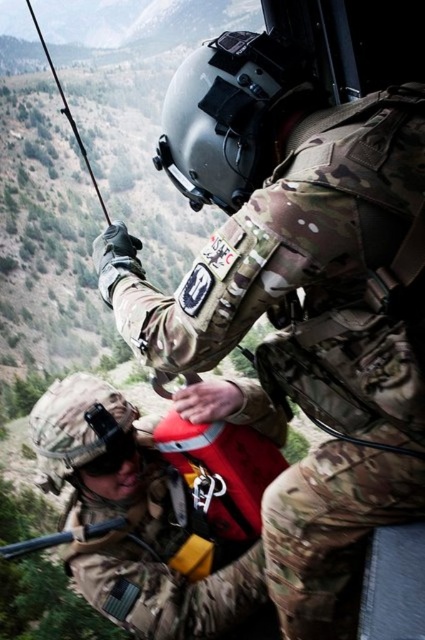
Does camouflage uniform at center come behind matte black rifle at center?

No.

Who is higher up, camouflage uniform at center or matte black rifle at center?

camouflage uniform at center is above.

Who is more distant from viewer, [397,250] or [11,554]?

Point [11,554]

Find the location of a particular element. The width and height of the screenshot is (425, 640). camouflage uniform at center is located at coordinates (297, 296).